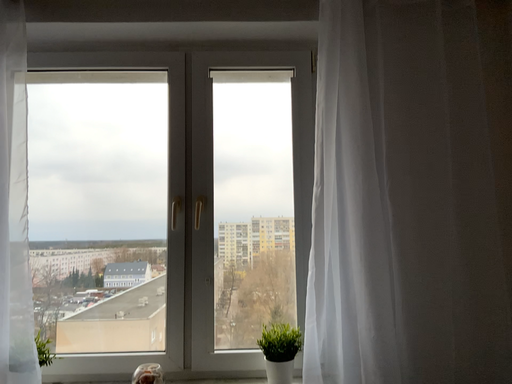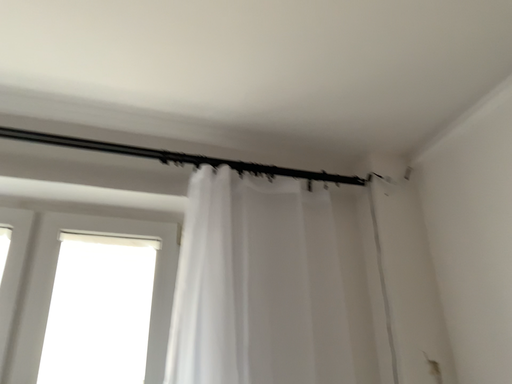
Question: How did the camera likely rotate when shooting the video?

Choices:
 (A) rotated right
 (B) rotated left

Answer: (A)